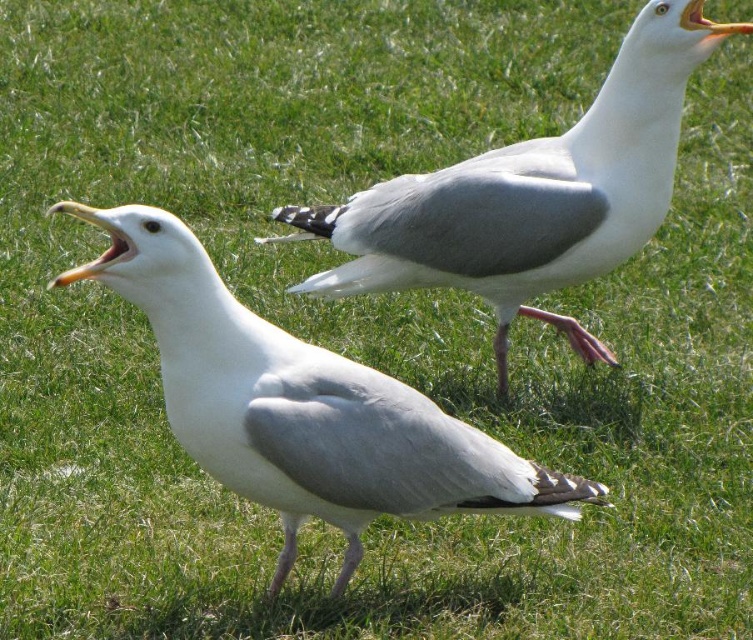
Question: Can you confirm if white matte seagull at center is bigger than white matte seagull at upper center?

Choices:
 (A) yes
 (B) no

Answer: (B)

Question: Which of the following is the farthest from the observer?

Choices:
 (A) white matte seagull at upper center
 (B) white matte seagull at center

Answer: (A)

Question: Is white matte seagull at center positioned before white matte seagull at upper center?

Choices:
 (A) no
 (B) yes

Answer: (B)

Question: Among these objects, which one is farthest from the camera?

Choices:
 (A) white matte seagull at upper center
 (B) white matte seagull at center

Answer: (A)

Question: Does white matte seagull at center appear on the right side of white matte seagull at upper center?

Choices:
 (A) yes
 (B) no

Answer: (B)